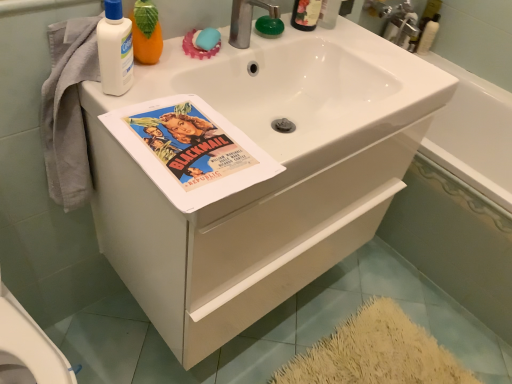
You are a GUI agent. You are given a task and a screenshot of the screen. Output one action in this format:
    pyautogui.click(x=<x>, y=<y>)
    Task: Click on the free space to the right of translucent plastic mouthwash at upper right
    This screenshot has width=512, height=384.
    Given the screenshot: What is the action you would take?
    pyautogui.click(x=358, y=43)